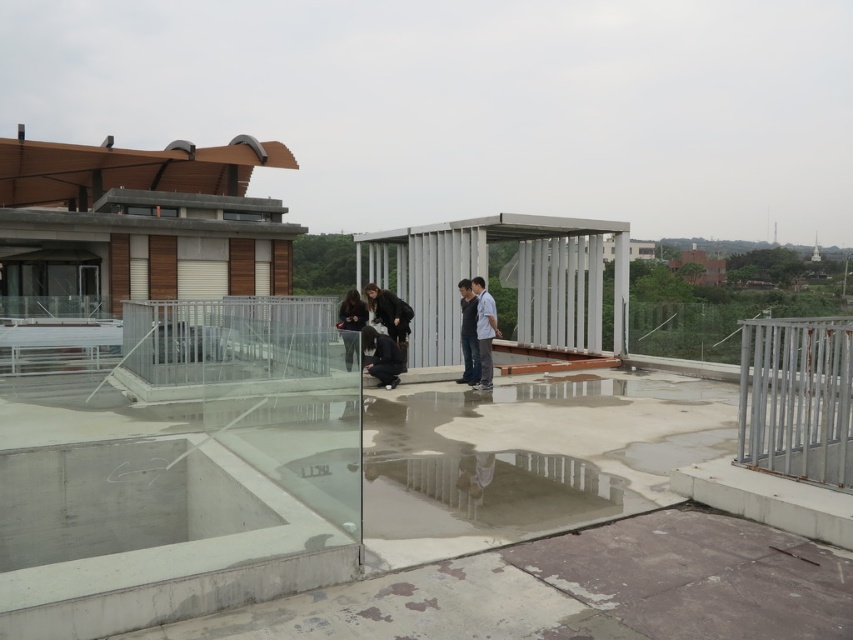
Question: Which of these objects is positioned closest to the matte black clothing at center?

Choices:
 (A) dark brown leather jacket at center
 (B) matte black jacket at center

Answer: (A)

Question: Is dark gray fabric shirt at center further to camera compared to matte black jacket at center?

Choices:
 (A) yes
 (B) no

Answer: (A)

Question: Where is silver metallic rail at right located in relation to matte black clothing at center in the image?

Choices:
 (A) right
 (B) left

Answer: (A)

Question: Which point is farther from the camera taking this photo?

Choices:
 (A) [x=403, y=339]
 (B) [x=469, y=330]
 (C) [x=840, y=429]
 (D) [x=350, y=342]

Answer: (A)

Question: Estimate the real-world distances between objects in this image. Which object is closer to the dark gray fabric shirt at center?

Choices:
 (A) matte black clothing at center
 (B) silver metallic rail at right
 (C) matte black jacket at center
 (D) dark brown leather jacket at center

Answer: (A)

Question: In this image, where is matte black clothing at center located relative to dark brown leather jacket at center?

Choices:
 (A) right
 (B) left

Answer: (A)